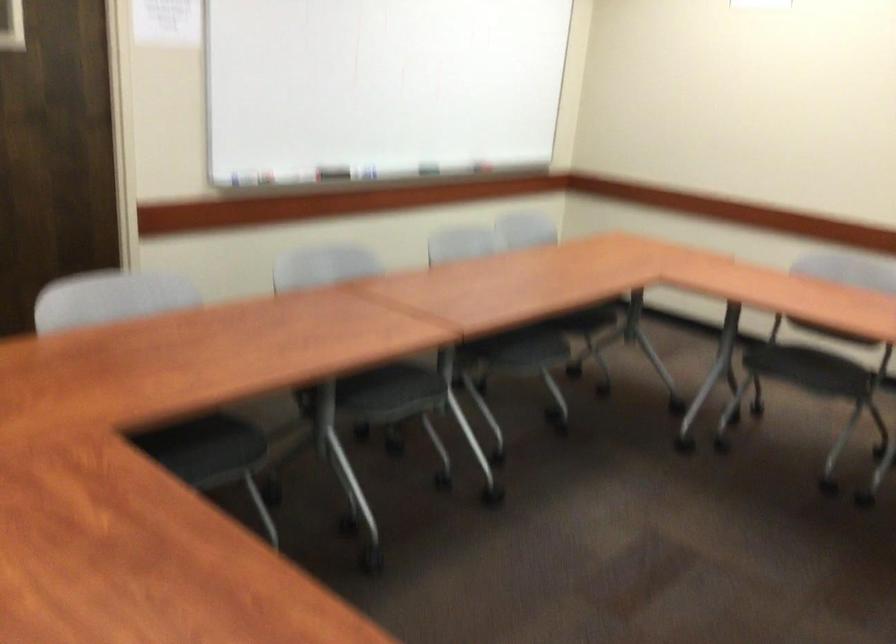
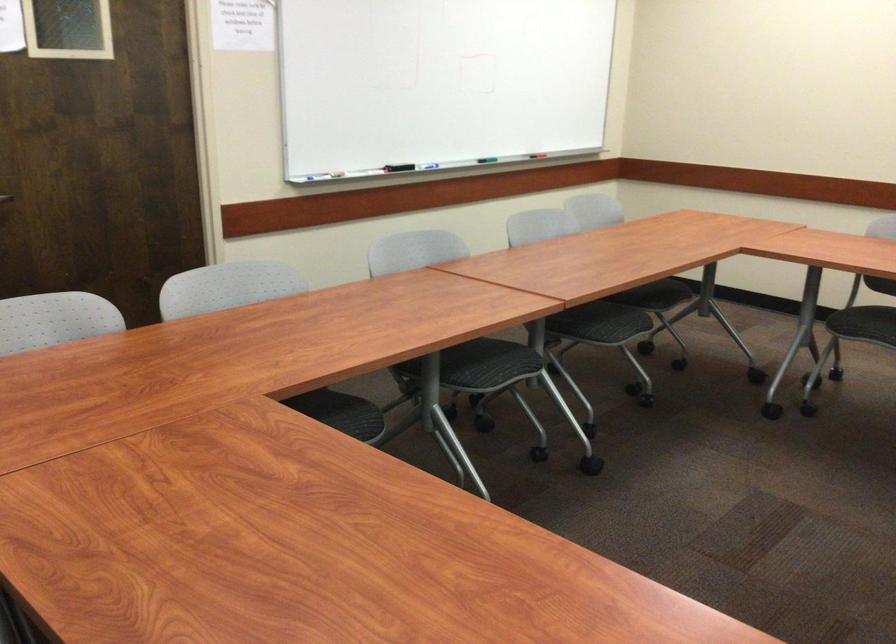
In the second image, find the point that corresponds to the point at 382,91 in the first image.

(438, 82)